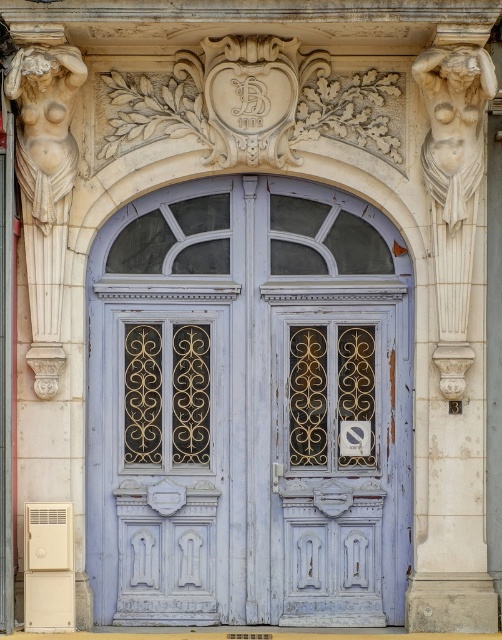
Question: Which of these objects is positioned closest to the white marble statue at left?

Choices:
 (A) chipped paint wooden door at center
 (B) light blue wood door at center

Answer: (B)

Question: Is white stone nude figure at right smaller than white marble statue at left?

Choices:
 (A) yes
 (B) no

Answer: (A)

Question: Which object is closer to the camera taking this photo?

Choices:
 (A) white stone nude figure at right
 (B) chipped paint wooden door at center
 (C) white marble statue at left
 (D) light blue wood door at center

Answer: (C)

Question: Which point is closer to the camera taking this photo?

Choices:
 (A) pyautogui.click(x=447, y=108)
 (B) pyautogui.click(x=37, y=192)

Answer: (A)

Question: Is light blue wood door at center wider than chipped paint wooden door at center?

Choices:
 (A) yes
 (B) no

Answer: (A)

Question: Can you confirm if chipped paint wooden door at center is smaller than white stone nude figure at right?

Choices:
 (A) no
 (B) yes

Answer: (B)